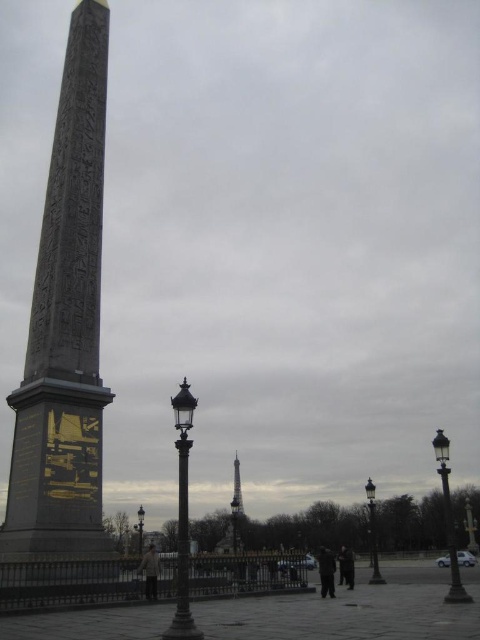
What do you see at coordinates (149, 572) in the screenshot? This screenshot has width=480, height=640. I see `light beige sweater at center` at bounding box center [149, 572].

Is light beige sweater at center taller than dark gray fabric pants at center?

No.

Is point (137, 572) closer to viewer compared to point (332, 580)?

Yes.

Image resolution: width=480 pixels, height=640 pixels. Identify the location of light beige sweater at center. (149, 572).

Which is in front, point (154, 568) or point (352, 570)?

Point (154, 568) is more forward.

Measure the distance between light beige sweater at center and dark gray jacket at lower center.

light beige sweater at center and dark gray jacket at lower center are 35.39 meters apart.

Between point (151, 564) and point (342, 561), which one is positioned in front?

Positioned in front is point (151, 564).

You are a GUI agent. You are given a task and a screenshot of the screen. Output one action in this format:
    pyautogui.click(x=<x>, y=<y>)
    Task: Click on the light beige sweater at center
    Image resolution: width=480 pixels, height=640 pixels.
    Given the screenshot: What is the action you would take?
    pyautogui.click(x=149, y=572)

Can you confirm if black polished stone obelisk at left is bigger than dark gray fabric pants at center?

Yes, black polished stone obelisk at left is bigger than dark gray fabric pants at center.

Does black polished stone obelisk at left come in front of dark gray fabric pants at center?

Yes.

The height and width of the screenshot is (640, 480). Describe the element at coordinates (64, 332) in the screenshot. I see `black polished stone obelisk at left` at that location.

This screenshot has width=480, height=640. Find the location of `black polished stone obelisk at left`. black polished stone obelisk at left is located at coordinates (64, 332).